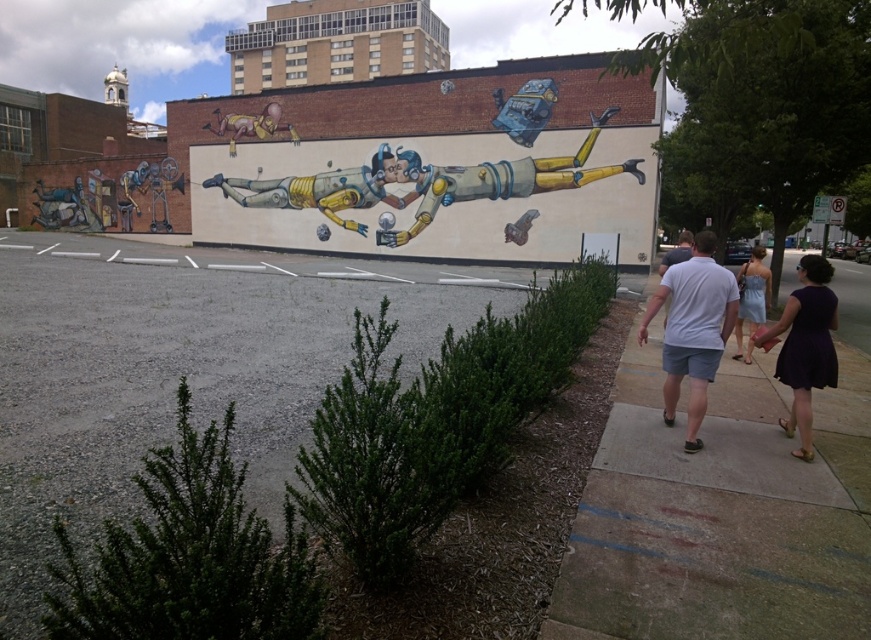
Question: Which of the following is the farthest from the observer?

Choices:
 (A) metallic yellow robot at center
 (B) metallic gold horse at upper left

Answer: (B)

Question: Which of the following is the farthest from the observer?

Choices:
 (A) metallic yellow astronaut at center
 (B) concrete sidewalk at center right
 (C) metallic gold horse at upper left

Answer: (C)

Question: Which object is positioned closest to the metallic yellow robot at center?

Choices:
 (A) concrete sidewalk at center right
 (B) light blue dress at right
 (C) metallic yellow astronaut at center
 (D) purple satin dress at lower right

Answer: (C)

Question: Is metallic yellow astronaut at center further to camera compared to metallic gold horse at upper left?

Choices:
 (A) yes
 (B) no

Answer: (B)

Question: Where is concrete sidewalk at center right located in relation to metallic yellow astronaut at center in the image?

Choices:
 (A) below
 (B) above

Answer: (A)

Question: From the image, what is the correct spatial relationship of white cotton shirt at center in relation to purple satin dress at lower right?

Choices:
 (A) left
 (B) right

Answer: (A)